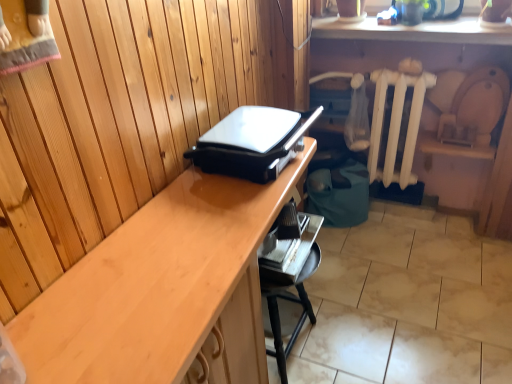
Question: Is wooden desk at center facing towards metallic silver tray at lower center?

Choices:
 (A) no
 (B) yes

Answer: (B)

Question: Would you consider wooden desk at center to be distant from metallic silver tray at lower center?

Choices:
 (A) no
 (B) yes

Answer: (A)

Question: Considering the relative sizes of wooden desk at center and metallic silver tray at lower center in the image provided, is wooden desk at center shorter than metallic silver tray at lower center?

Choices:
 (A) yes
 (B) no

Answer: (B)

Question: Is wooden desk at center touching metallic silver tray at lower center?

Choices:
 (A) yes
 (B) no

Answer: (B)

Question: Considering the relative sizes of wooden desk at center and metallic silver tray at lower center in the image provided, is wooden desk at center taller than metallic silver tray at lower center?

Choices:
 (A) yes
 (B) no

Answer: (A)

Question: Does wooden desk at center have a greater width compared to metallic silver tray at lower center?

Choices:
 (A) yes
 (B) no

Answer: (A)

Question: Does white painted wood radiator at center right lie in front of metallic silver tray at lower center?

Choices:
 (A) yes
 (B) no

Answer: (B)

Question: Considering the relative sizes of white painted wood radiator at center right and metallic silver tray at lower center in the image provided, is white painted wood radiator at center right taller than metallic silver tray at lower center?

Choices:
 (A) no
 (B) yes

Answer: (B)

Question: From the image's perspective, is white painted wood radiator at center right located beneath metallic silver tray at lower center?

Choices:
 (A) yes
 (B) no

Answer: (B)

Question: Is white painted wood radiator at center right touching metallic silver tray at lower center?

Choices:
 (A) no
 (B) yes

Answer: (A)

Question: Does white painted wood radiator at center right appear on the right side of metallic silver tray at lower center?

Choices:
 (A) no
 (B) yes

Answer: (B)

Question: Is white painted wood radiator at center right outside of metallic silver tray at lower center?

Choices:
 (A) yes
 (B) no

Answer: (A)

Question: From a real-world perspective, does metallic silver tray at lower center sit lower than black plastic grill at center?

Choices:
 (A) no
 (B) yes

Answer: (B)